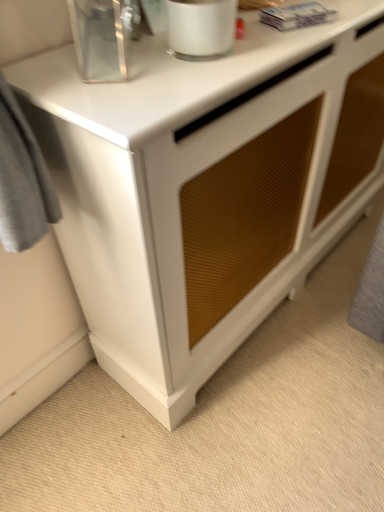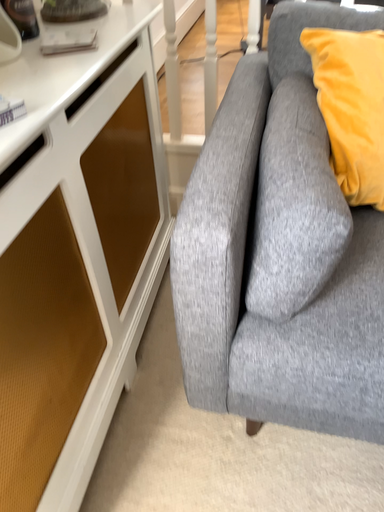
Question: Which way did the camera rotate in the video?

Choices:
 (A) rotated left
 (B) rotated right

Answer: (B)